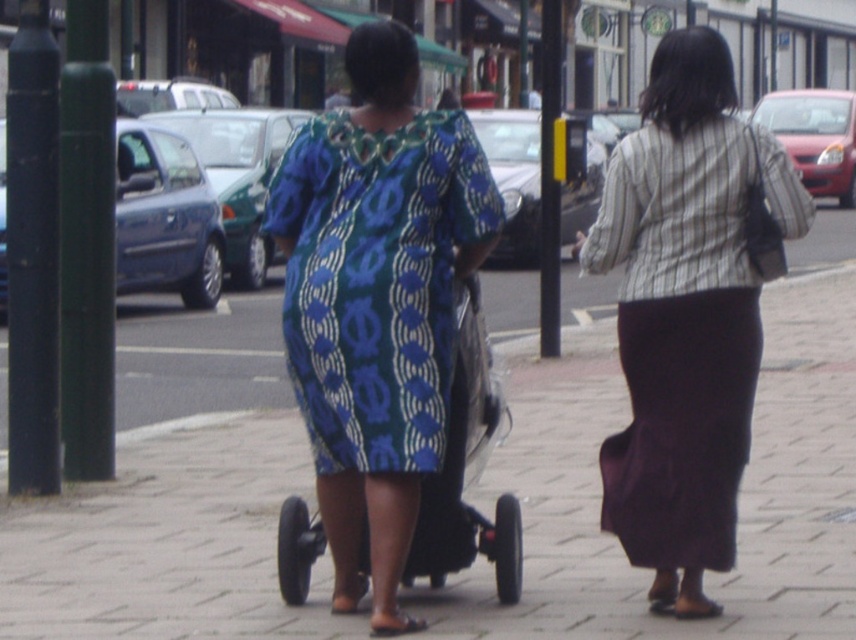
Is point (847, 628) more distant than point (480, 316)?

No, it is in front of (480, 316).

At what (x,y) coordinates should I click in order to perform the action: click on brick pavement at center. Please return your answer as a coordinate pair (x, y). The width and height of the screenshot is (856, 640). Looking at the image, I should click on point(740,493).

Locate an element on the screen. This screenshot has height=640, width=856. brick pavement at center is located at coordinates (740, 493).

Between point (649, 461) and point (352, 368), which one is positioned behind?

Point (649, 461)

The image size is (856, 640). What do you see at coordinates (681, 321) in the screenshot? I see `striped fabric skirt at center` at bounding box center [681, 321].

Identify the location of striped fabric skirt at center. The image size is (856, 640). (681, 321).

Looking at this image, is brick pavement at center below striped fabric skirt at center?

Correct, brick pavement at center is located below striped fabric skirt at center.

Is brick pavement at center to the right of striped fabric skirt at center from the viewer's perspective?

No, brick pavement at center is not to the right of striped fabric skirt at center.

You are a GUI agent. You are given a task and a screenshot of the screen. Output one action in this format:
    pyautogui.click(x=<x>, y=<y>)
    Task: Click on the brick pavement at center
    
    Given the screenshot: What is the action you would take?
    pyautogui.click(x=740, y=493)